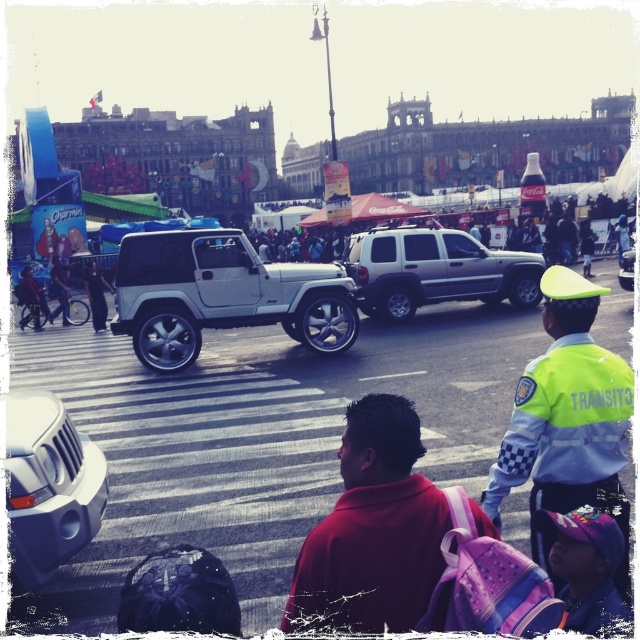
Between reflective silver helmet at center and silver matte jeep at center, which one has less height?

Standing shorter between the two is silver matte jeep at center.

Is reflective silver helmet at center above silver matte jeep at center?

Actually, reflective silver helmet at center is below silver matte jeep at center.

Where is `reflective silver helmet at center`? reflective silver helmet at center is located at coordinates pyautogui.click(x=568, y=417).

Looking at this image, does silver metallic car at center appear over matte black bicycle at left?

No.

Is silver metallic car at center positioned at the back of matte black bicycle at left?

No, silver metallic car at center is in front of matte black bicycle at left.

Who is more forward, (104, 310) or (22, 321)?

Point (104, 310) is in front.

You are a GUI agent. You are given a task and a screenshot of the screen. Output one action in this format:
    pyautogui.click(x=<x>, y=<y>)
    Task: Click on the silver metallic car at center
    This screenshot has width=640, height=640.
    Given the screenshot: What is the action you would take?
    pyautogui.click(x=97, y=296)

Where is `silver metallic car at center`? This screenshot has width=640, height=640. silver metallic car at center is located at coordinates (97, 296).

Is point (100, 300) more distant than point (627, 260)?

Yes, it is.

This screenshot has width=640, height=640. What are the coordinates of `silver metallic car at center` in the screenshot? It's located at (97, 296).